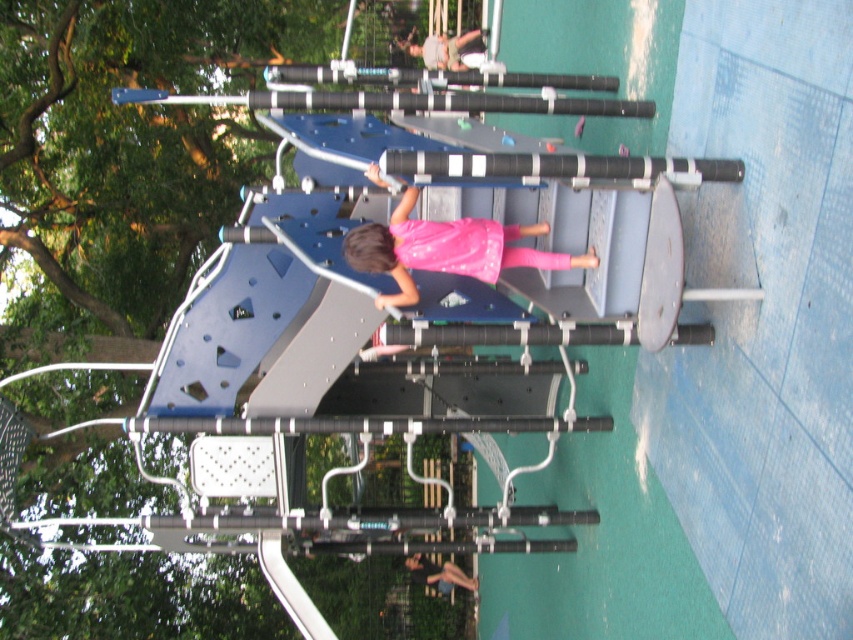
Question: Which object is farther from the camera taking this photo?

Choices:
 (A) pink fabric dress at center
 (B) pink matte dress at center

Answer: (A)

Question: Can you confirm if pink matte dress at center is wider than pink fabric dress at center?

Choices:
 (A) yes
 (B) no

Answer: (A)

Question: Which point is closer to the camera taking this photo?

Choices:
 (A) (426, 51)
 (B) (379, 237)

Answer: (B)

Question: Which object appears closest to the camera in this image?

Choices:
 (A) pink fabric dress at center
 (B) pink matte dress at center

Answer: (B)

Question: Does pink matte dress at center have a smaller size compared to pink fabric dress at center?

Choices:
 (A) no
 (B) yes

Answer: (A)

Question: Is pink matte dress at center to the right of pink fabric dress at center from the viewer's perspective?

Choices:
 (A) no
 (B) yes

Answer: (A)